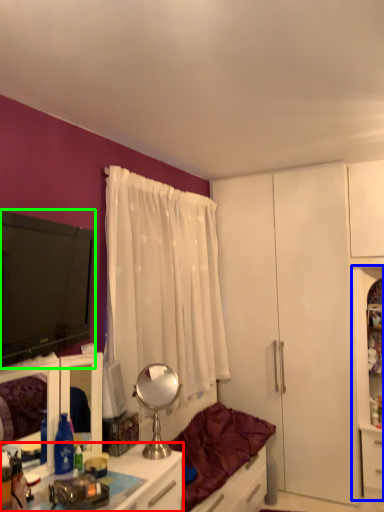
Question: Which object is positioned closest to desk (highlighted by a red box)? Select from file cabinet (highlighted by a blue box) and television (highlighted by a green box).

Choices:
 (A) file cabinet
 (B) television

Answer: (B)